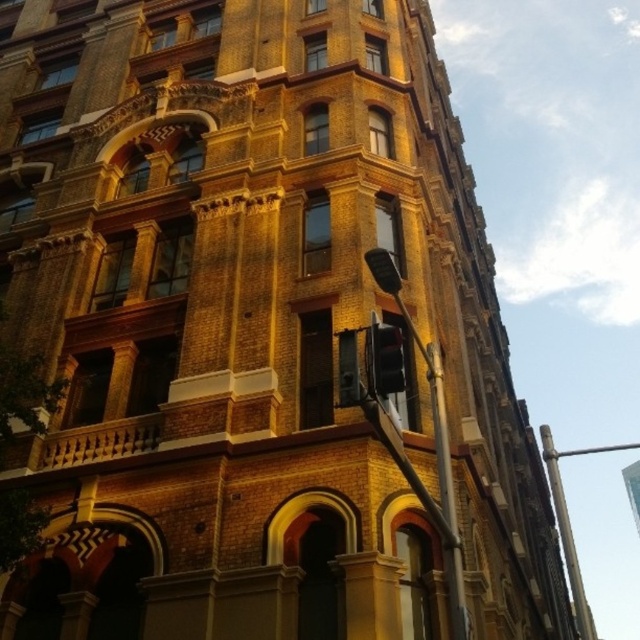
Question: Does metallic pole at center appear under black glass traffic light at center?

Choices:
 (A) no
 (B) yes

Answer: (B)

Question: Which point is farther to the camera?

Choices:
 (A) (381, 339)
 (B) (429, 348)

Answer: (B)

Question: Which of the following is the farthest from the observer?

Choices:
 (A) metallic pole at center
 (B) black glass traffic light at center

Answer: (A)

Question: Is the position of metallic pole at center more distant than that of black glass traffic light at center?

Choices:
 (A) no
 (B) yes

Answer: (B)

Question: Is metallic pole at center above black glass traffic light at center?

Choices:
 (A) yes
 (B) no

Answer: (B)